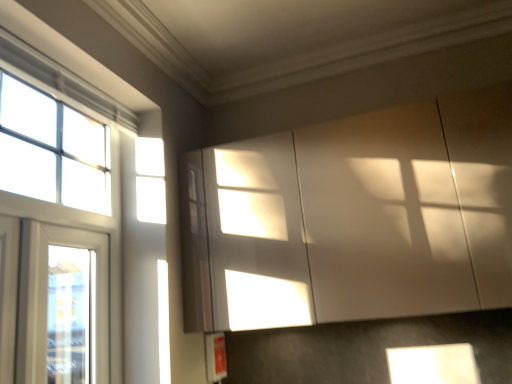
Question: Is white glass window at left, placed as the 2th window when sorted from top to bottom, surrounded by white glossy cabinet at upper right?

Choices:
 (A) yes
 (B) no

Answer: (B)

Question: From the image's perspective, would you say white glossy cabinet at upper right is shown under white glass window at left, which ranks as the 2th window in bottom-to-top order?

Choices:
 (A) yes
 (B) no

Answer: (B)

Question: Is white glossy cabinet at upper right closer to the viewer compared to white glass window at left, which ranks as the 2th window in bottom-to-top order?

Choices:
 (A) no
 (B) yes

Answer: (A)

Question: Would you say white glossy cabinet at upper right is outside white glass window at left, which ranks as the 2th window in bottom-to-top order?

Choices:
 (A) no
 (B) yes

Answer: (B)

Question: Could you tell me if white glossy cabinet at upper right is turned towards white glass window at left, placed as the 2th window when sorted from top to bottom?

Choices:
 (A) yes
 (B) no

Answer: (B)

Question: Does white glossy cabinet at upper right have a greater width compared to white glass window at left, placed as the 2th window when sorted from top to bottom?

Choices:
 (A) yes
 (B) no

Answer: (A)

Question: Is white glass window at left, the 3th window when ordered from top to bottom, bigger than clear glass window at upper left, which appears as the 1th window when viewed from the top?

Choices:
 (A) no
 (B) yes

Answer: (B)

Question: Can you confirm if white glass window at left, the 3th window when ordered from top to bottom, is positioned to the left of clear glass window at upper left, which appears as the 1th window when viewed from the top?

Choices:
 (A) no
 (B) yes

Answer: (A)

Question: From the image's perspective, does white glass window at left, the 3th window when ordered from top to bottom, appear lower than clear glass window at upper left, placed as the third window when sorted from bottom to top?

Choices:
 (A) yes
 (B) no

Answer: (A)

Question: Are white glass window at left, the 3th window when ordered from top to bottom, and clear glass window at upper left, placed as the third window when sorted from bottom to top, located far from each other?

Choices:
 (A) no
 (B) yes

Answer: (A)

Question: Is white glass window at left, acting as the first window starting from the bottom, shorter than clear glass window at upper left, which appears as the 1th window when viewed from the top?

Choices:
 (A) no
 (B) yes

Answer: (A)

Question: Does white glass window at left, the 3th window when ordered from top to bottom, appear on the right side of clear glass window at upper left, which appears as the 1th window when viewed from the top?

Choices:
 (A) no
 (B) yes

Answer: (B)

Question: Is white glass window at left, placed as the 2th window when sorted from top to bottom, looking in the opposite direction of white glass window at left, acting as the first window starting from the bottom?

Choices:
 (A) no
 (B) yes

Answer: (B)